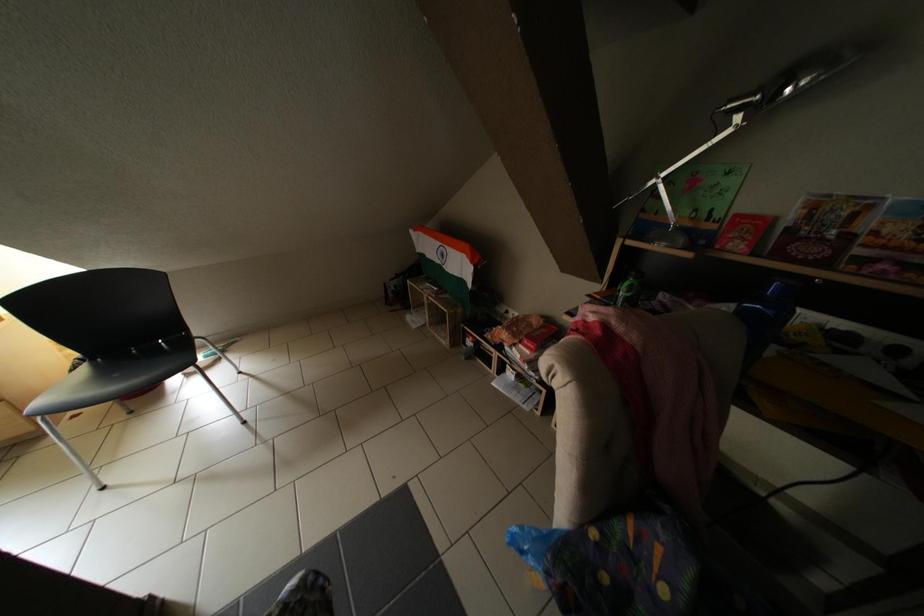
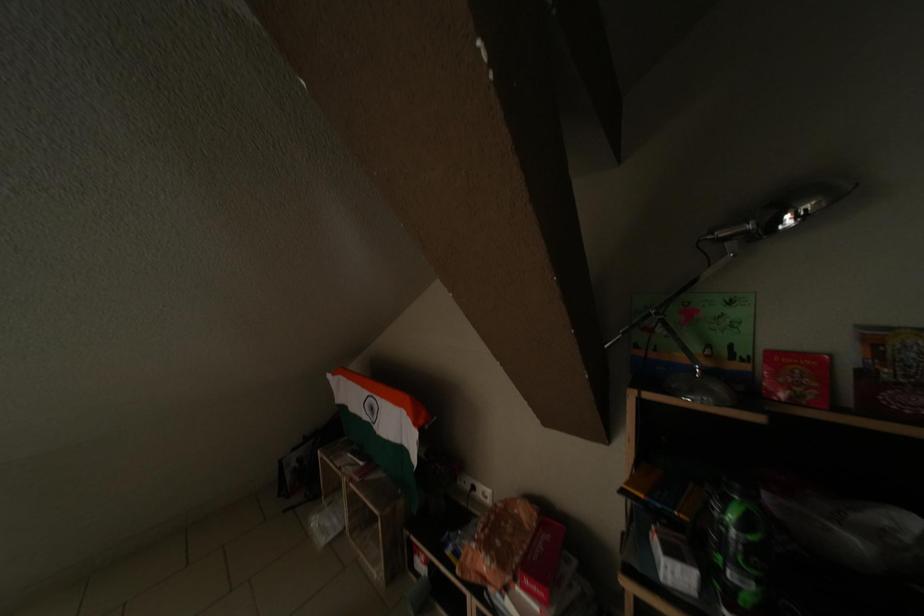
The first image is from the beginning of the video and the second image is from the end. How did the camera likely rotate when shooting the video?

The rotation direction of the camera is right-up.